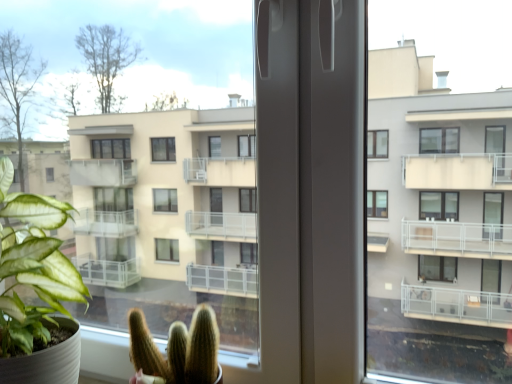
What do you see at coordinates (36, 287) in the screenshot? I see `green matte plant at left, arranged as the second houseplant when viewed from the right` at bounding box center [36, 287].

Where is `green matte plant at left, arranged as the 1th houseplant when viewed from the left`? green matte plant at left, arranged as the 1th houseplant when viewed from the left is located at coordinates (36, 287).

How much space does green matte plant at left, arranged as the 1th houseplant when viewed from the left, occupy vertically?

It is 19.51 inches.

Find the location of a particular element. The image size is (512, 384). green matte cactus at lower center, the 2th houseplant when ordered from left to right is located at coordinates (178, 349).

What do you see at coordinates (178, 349) in the screenshot? I see `green matte cactus at lower center, the 2th houseplant when ordered from left to right` at bounding box center [178, 349].

How much space does green matte cactus at lower center, the 2th houseplant when ordered from left to right, occupy horizontally?

green matte cactus at lower center, the 2th houseplant when ordered from left to right, is 6.67 inches wide.

You are a GUI agent. You are given a task and a screenshot of the screen. Output one action in this format:
    pyautogui.click(x=<x>, y=<y>)
    Task: Click on the green matte plant at left, arranged as the 1th houseplant when viewed from the left
    Image resolution: width=512 pixels, height=384 pixels.
    Given the screenshot: What is the action you would take?
    pyautogui.click(x=36, y=287)

Which object is positioned more to the left, green matte plant at left, arranged as the second houseplant when viewed from the right, or green matte cactus at lower center, acting as the 1th houseplant starting from the right?

green matte plant at left, arranged as the second houseplant when viewed from the right, is more to the left.

Is green matte plant at left, arranged as the second houseplant when viewed from the right, closer to the viewer compared to green matte cactus at lower center, the 2th houseplant when ordered from left to right?

Yes, it is in front of green matte cactus at lower center, the 2th houseplant when ordered from left to right.

Does point (42, 223) lie in front of point (203, 368)?

No, it is not.

From the image's perspective, relative to green matte cactus at lower center, the 2th houseplant when ordered from left to right, is green matte plant at left, arranged as the 1th houseplant when viewed from the left, above or below?

green matte plant at left, arranged as the 1th houseplant when viewed from the left, is situated higher than green matte cactus at lower center, the 2th houseplant when ordered from left to right, in the image.

From a real-world perspective, is green matte plant at left, arranged as the 1th houseplant when viewed from the left, beneath green matte cactus at lower center, acting as the 1th houseplant starting from the right?

Actually, green matte plant at left, arranged as the 1th houseplant when viewed from the left, is physically above green matte cactus at lower center, acting as the 1th houseplant starting from the right, in the real world.

Between green matte plant at left, arranged as the second houseplant when viewed from the right, and green matte cactus at lower center, the 2th houseplant when ordered from left to right, which one has smaller width?

green matte cactus at lower center, the 2th houseplant when ordered from left to right.

Can you confirm if green matte plant at left, arranged as the second houseplant when viewed from the right, is shorter than green matte cactus at lower center, the 2th houseplant when ordered from left to right?

In fact, green matte plant at left, arranged as the second houseplant when viewed from the right, may be taller than green matte cactus at lower center, the 2th houseplant when ordered from left to right.

Considering the sizes of green matte plant at left, arranged as the second houseplant when viewed from the right, and green matte cactus at lower center, the 2th houseplant when ordered from left to right, in the image, is green matte plant at left, arranged as the second houseplant when viewed from the right, bigger or smaller than green matte cactus at lower center, the 2th houseplant when ordered from left to right,?

green matte plant at left, arranged as the second houseplant when viewed from the right, is bigger than green matte cactus at lower center, the 2th houseplant when ordered from left to right.

Is green matte plant at left, arranged as the second houseplant when viewed from the right, completely or partially outside of green matte cactus at lower center, acting as the 1th houseplant starting from the right?

green matte plant at left, arranged as the second houseplant when viewed from the right, is positioned outside green matte cactus at lower center, acting as the 1th houseplant starting from the right.

Would you say green matte plant at left, arranged as the second houseplant when viewed from the right, is a long distance from green matte cactus at lower center, the 2th houseplant when ordered from left to right?

green matte plant at left, arranged as the second houseplant when viewed from the right, is actually quite close to green matte cactus at lower center, the 2th houseplant when ordered from left to right.

Is green matte plant at left, arranged as the second houseplant when viewed from the right, looking in the opposite direction of green matte cactus at lower center, acting as the 1th houseplant starting from the right?

green matte plant at left, arranged as the second houseplant when viewed from the right, is not turned away from green matte cactus at lower center, acting as the 1th houseplant starting from the right.

This screenshot has height=384, width=512. In order to click on houseplant behind the green matte plant at left, arranged as the second houseplant when viewed from the right in this screenshot , I will do `click(178, 349)`.

Consider the image. Between green matte cactus at lower center, the 2th houseplant when ordered from left to right, and green matte plant at left, arranged as the second houseplant when viewed from the right, which one appears on the right side from the viewer's perspective?

green matte cactus at lower center, the 2th houseplant when ordered from left to right.

Consider the image. Which object is closer to the camera, green matte cactus at lower center, acting as the 1th houseplant starting from the right, or green matte plant at left, arranged as the second houseplant when viewed from the right?

green matte plant at left, arranged as the second houseplant when viewed from the right, is more forward.

Does point (195, 310) lie behind point (50, 379)?

Yes, it is behind point (50, 379).

From the image's perspective, is green matte cactus at lower center, acting as the 1th houseplant starting from the right, located above green matte plant at left, arranged as the 1th houseplant when viewed from the left?

Actually, green matte cactus at lower center, acting as the 1th houseplant starting from the right, appears below green matte plant at left, arranged as the 1th houseplant when viewed from the left, in the image.

From a real-world perspective, is green matte cactus at lower center, acting as the 1th houseplant starting from the right, on top of green matte plant at left, arranged as the second houseplant when viewed from the right?

No, from a real-world perspective, green matte cactus at lower center, acting as the 1th houseplant starting from the right, is not over green matte plant at left, arranged as the second houseplant when viewed from the right

Considering the sizes of green matte cactus at lower center, the 2th houseplant when ordered from left to right, and green matte plant at left, arranged as the second houseplant when viewed from the right, in the image, is green matte cactus at lower center, the 2th houseplant when ordered from left to right, wider or thinner than green matte plant at left, arranged as the second houseplant when viewed from the right,?

Considering their sizes, green matte cactus at lower center, the 2th houseplant when ordered from left to right, looks slimmer than green matte plant at left, arranged as the second houseplant when viewed from the right.

Who is shorter, green matte cactus at lower center, the 2th houseplant when ordered from left to right, or green matte plant at left, arranged as the 1th houseplant when viewed from the left?

Standing shorter between the two is green matte cactus at lower center, the 2th houseplant when ordered from left to right.

Who is smaller, green matte cactus at lower center, the 2th houseplant when ordered from left to right, or green matte plant at left, arranged as the 1th houseplant when viewed from the left?

green matte cactus at lower center, the 2th houseplant when ordered from left to right, is smaller.

Is green matte cactus at lower center, acting as the 1th houseplant starting from the right, positioned beyond the bounds of green matte plant at left, arranged as the 1th houseplant when viewed from the left?

Yes, green matte cactus at lower center, acting as the 1th houseplant starting from the right, is not within green matte plant at left, arranged as the 1th houseplant when viewed from the left.

Is green matte cactus at lower center, the 2th houseplant when ordered from left to right, in contact with green matte plant at left, arranged as the second houseplant when viewed from the right?

No, green matte cactus at lower center, the 2th houseplant when ordered from left to right, is not with green matte plant at left, arranged as the second houseplant when viewed from the right.

Is green matte plant at left, arranged as the 1th houseplant when viewed from the left, at the back of green matte cactus at lower center, acting as the 1th houseplant starting from the right?

No, green matte cactus at lower center, acting as the 1th houseplant starting from the right,'s orientation is not away from green matte plant at left, arranged as the 1th houseplant when viewed from the left.

You are a GUI agent. You are given a task and a screenshot of the screen. Output one action in this format:
    pyautogui.click(x=<x>, y=<y>)
    Task: Click on the houseplant on the left side of green matte cactus at lower center, the 2th houseplant when ordered from left to right
    
    Given the screenshot: What is the action you would take?
    36,287

Identify the location of houseplant behind the green matte plant at left, arranged as the 1th houseplant when viewed from the left. This screenshot has width=512, height=384. (178, 349).

Where is `houseplant below the green matte plant at left, arranged as the second houseplant when viewed from the right (from a real-world perspective)`? The image size is (512, 384). houseplant below the green matte plant at left, arranged as the second houseplant when viewed from the right (from a real-world perspective) is located at coordinates (178, 349).